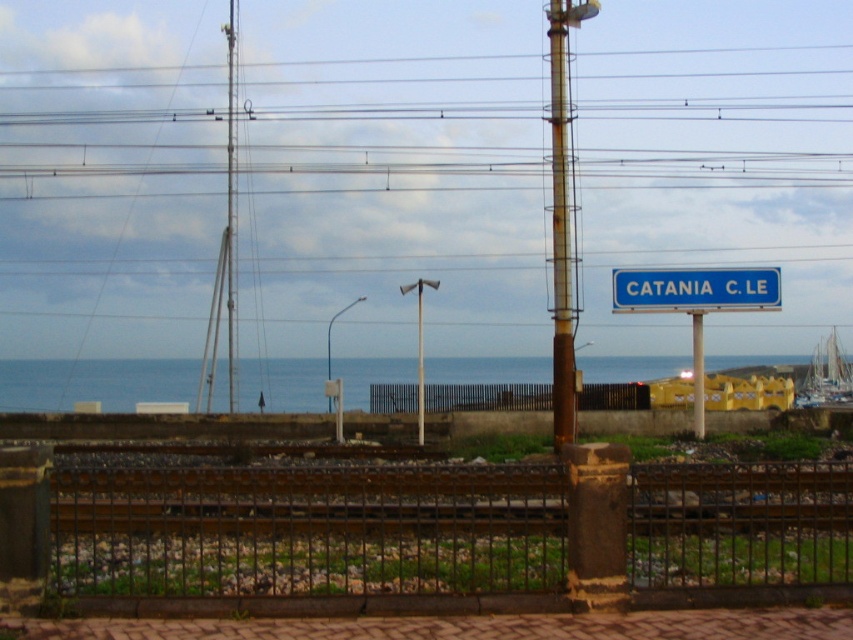
You are a photographer planning to take a picture of the coastal railway scene. You want to ensure that both the blue water at center and the rusty metal pole at center are clearly visible in the frame. Based on their sizes, which object should you prioritize positioning closer to the camera to ensure it doesn t get cropped out?

The blue water at center might be wider than the rusty metal pole at center, so you should prioritize positioning the rusty metal pole at center closer to the camera to ensure it doesn t get cropped out.

You are a railway inspector checking the area between the rusty metal pole at center and the black metal fence at center. Which object would you need to inspect first if you follow the standard protocol of prioritizing larger structures first?

The rusty metal pole at center is bigger than the black metal fence at center, so you should inspect the rusty metal pole at center first according to the protocol.

You are a maintenance worker inspecting the railway tracks. You notice the rusty metal pole at center and the black metal fence at center. Which object is directly above the other?

The rusty metal pole at center is positioned over the black metal fence at center, meaning it is directly above it.